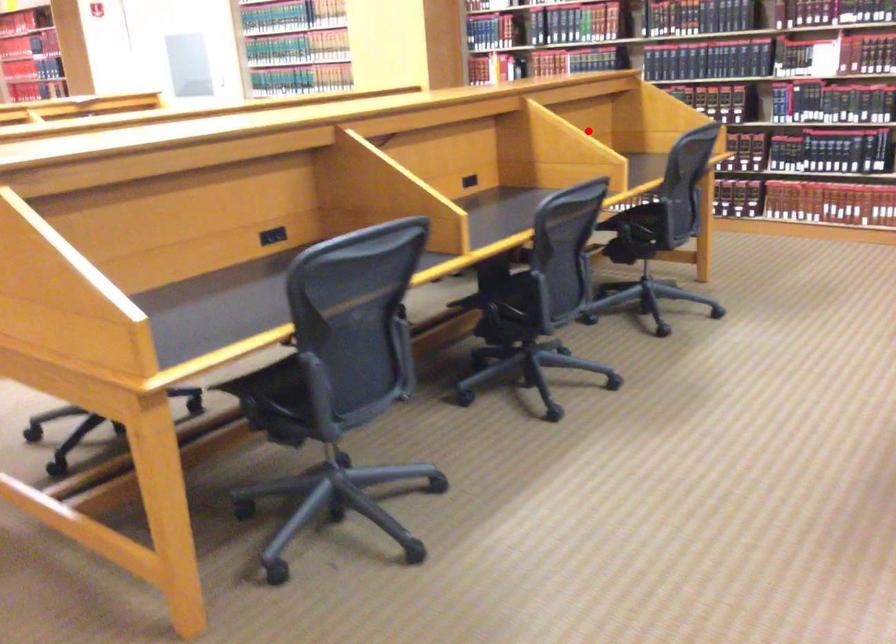
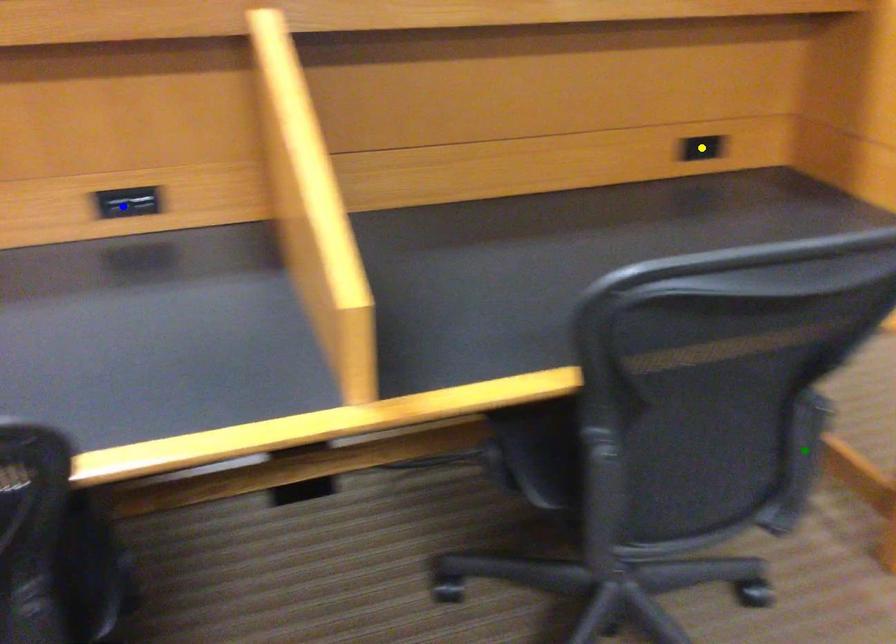
Question: I am providing you with two images of the same scene from different viewpoints. A red point is marked on the first image. You are given multiple points on the second image. Which spot in image 2 lines up with the point in image 1?

Choices:
 (A) green point
 (B) yellow point
 (C) blue point

Answer: (B)